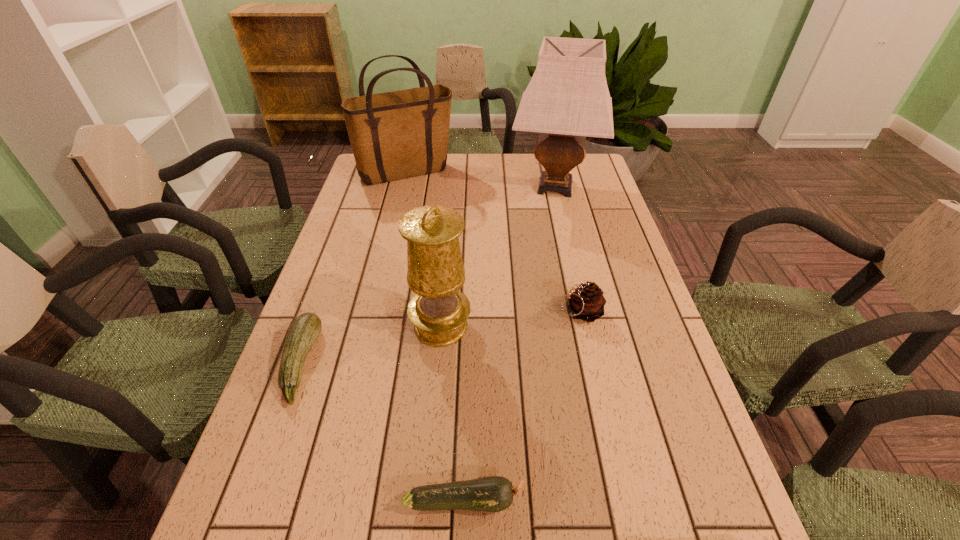
Locate an element on the screen. The height and width of the screenshot is (540, 960). vacant space located 0.110m on the front of the oil lamp is located at coordinates (435, 393).

The width and height of the screenshot is (960, 540). I want to click on vacant space located 0.160m with a leaf charm attached to the pinecone, so click(x=492, y=312).

At what (x,y) coordinates should I click in order to perform the action: click on vacant space located 0.270m with a leaf charm attached to the pinecone. Please return your answer as a coordinate pair (x, y). Looking at the image, I should click on (448, 312).

Identify the location of free space located 0.360m with a leaf charm attached to the pinecone. This screenshot has width=960, height=540. (411, 312).

Identify the location of free space located 0.200m at the stem end of the left zucchini. (406, 363).

Where is `free region located 0.070m at the blossom end of the nearest object`? This screenshot has height=540, width=960. free region located 0.070m at the blossom end of the nearest object is located at coordinates (564, 501).

Image resolution: width=960 pixels, height=540 pixels. Identify the location of lampshade present at the far edge. (567, 99).

The height and width of the screenshot is (540, 960). What are the coordinates of `tote bag at the far edge` in the screenshot? It's located at (400, 134).

Where is `tote bag present at the left edge`? Image resolution: width=960 pixels, height=540 pixels. tote bag present at the left edge is located at coordinates (400, 134).

Locate an element on the screen. The image size is (960, 540). zucchini positioned at the left edge is located at coordinates point(305,329).